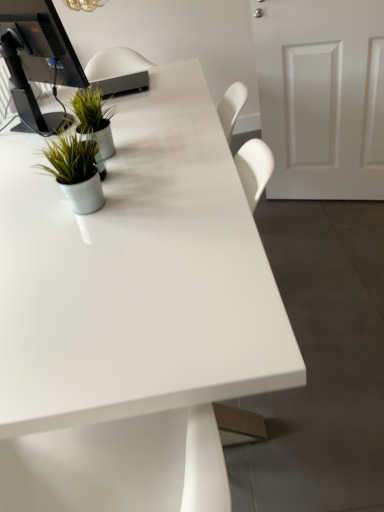
Identify the location of free space in front of metallic silver pot at left, which is counted as the first houseplant, starting from the bottom. The height and width of the screenshot is (512, 384). (83, 237).